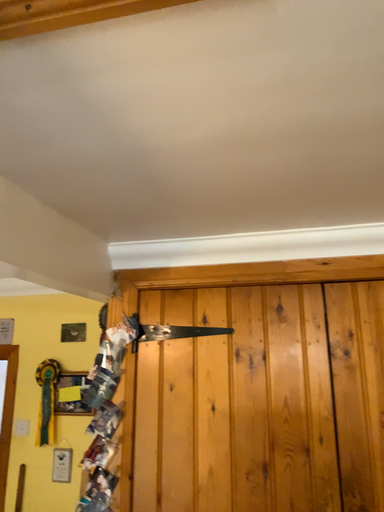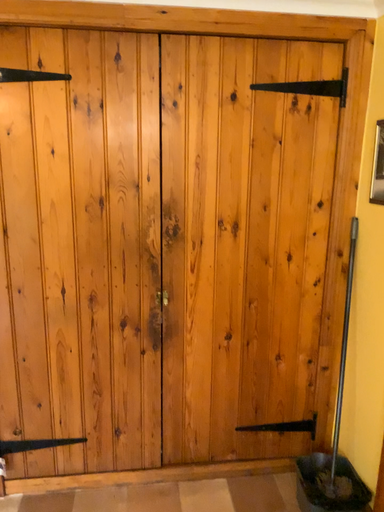
Question: How did the camera likely rotate when shooting the video?

Choices:
 (A) rotated left
 (B) rotated right

Answer: (B)